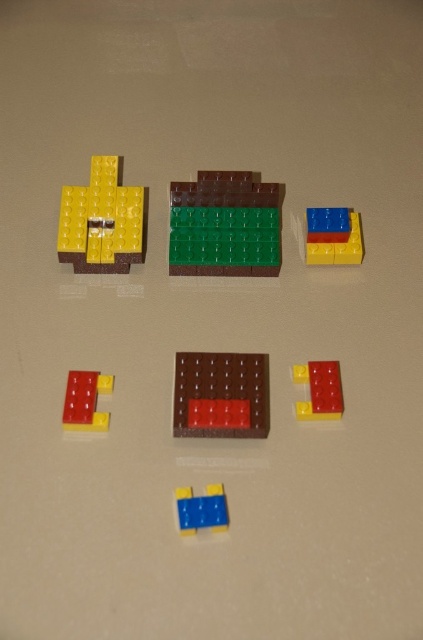
Question: Which point is farther to the camera?

Choices:
 (A) rubberized red brick at lower left
 (B) blue plastic brick at lower center

Answer: (A)

Question: Can you confirm if brown matte rectangular block at center is bigger than rubberized red brick at lower left?

Choices:
 (A) no
 (B) yes

Answer: (B)

Question: Does rubberized blue and red blocks at upper right appear under blue plastic brick at lower center?

Choices:
 (A) yes
 (B) no

Answer: (B)

Question: Among these points, which one is farthest from the camera?

Choices:
 (A) (219, 484)
 (B) (63, 204)
 (C) (230, 240)
 (D) (302, 416)

Answer: (C)

Question: Which of these objects is positioned closest to the translucent yellow brick at center?

Choices:
 (A) yellow matte brick at upper left
 (B) rubberized blue and red blocks at upper right

Answer: (B)

Question: Can you confirm if rubberized red brick at lower left is wider than translucent yellow brick at center?

Choices:
 (A) yes
 (B) no

Answer: (B)